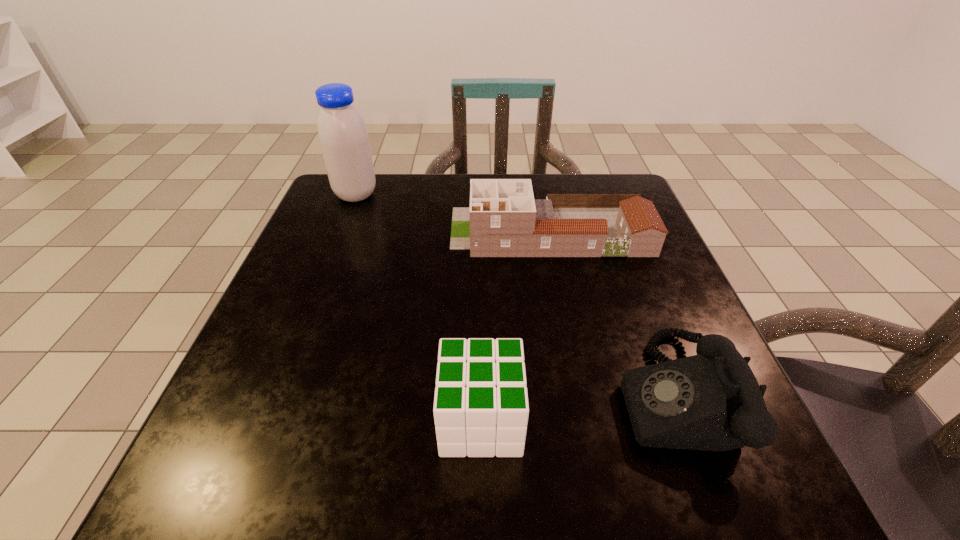
Find the location of `free space between the cube and the third shortest object`. free space between the cube and the third shortest object is located at coordinates (516, 326).

You are a GUI agent. You are given a task and a screenshot of the screen. Output one action in this format:
    pyautogui.click(x=<x>, y=<y>)
    Task: Click on the vacant space in between the cube and the second farthest object
    The image size is (960, 540).
    Given the screenshot: What is the action you would take?
    pyautogui.click(x=516, y=326)

Where is `free space between the cube and the dollhouse`? The width and height of the screenshot is (960, 540). free space between the cube and the dollhouse is located at coordinates (516, 326).

Image resolution: width=960 pixels, height=540 pixels. I want to click on vacant space that's between the second farthest object and the cube, so click(516, 326).

Identify the location of free space between the soya milk and the telephone. This screenshot has width=960, height=540. (514, 294).

The image size is (960, 540). Find the location of `vacant region between the telephone and the cube`. vacant region between the telephone and the cube is located at coordinates (577, 407).

This screenshot has height=540, width=960. What are the coordinates of `unoccupied area between the cube and the telephone` in the screenshot? It's located at (577, 407).

Where is `free area in between the farthest object and the dollhouse`? free area in between the farthest object and the dollhouse is located at coordinates (453, 213).

This screenshot has height=540, width=960. What are the coordinates of `free space between the telephone and the cube` in the screenshot? It's located at (577, 407).

Identify the location of vacant area between the farthest object and the cube. Image resolution: width=960 pixels, height=540 pixels. (419, 307).